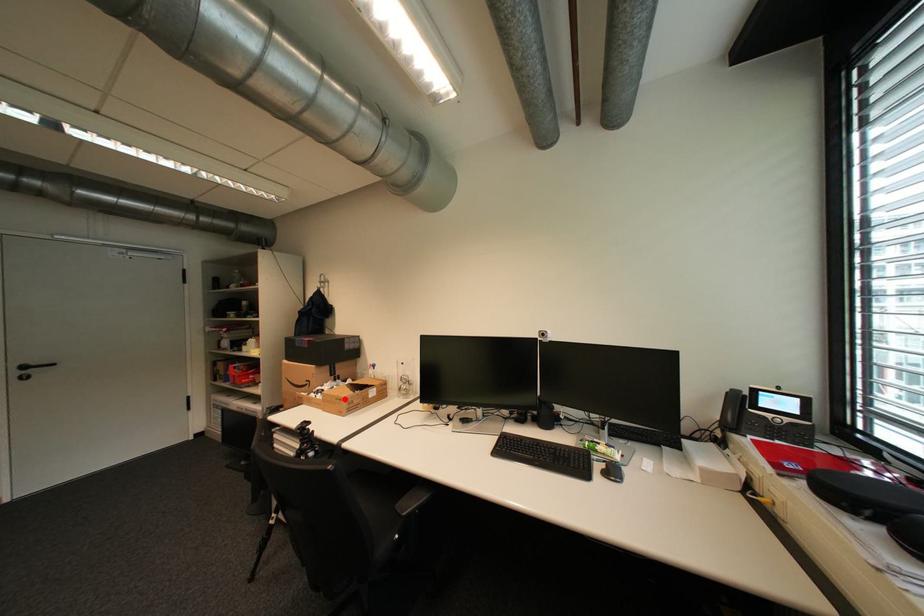
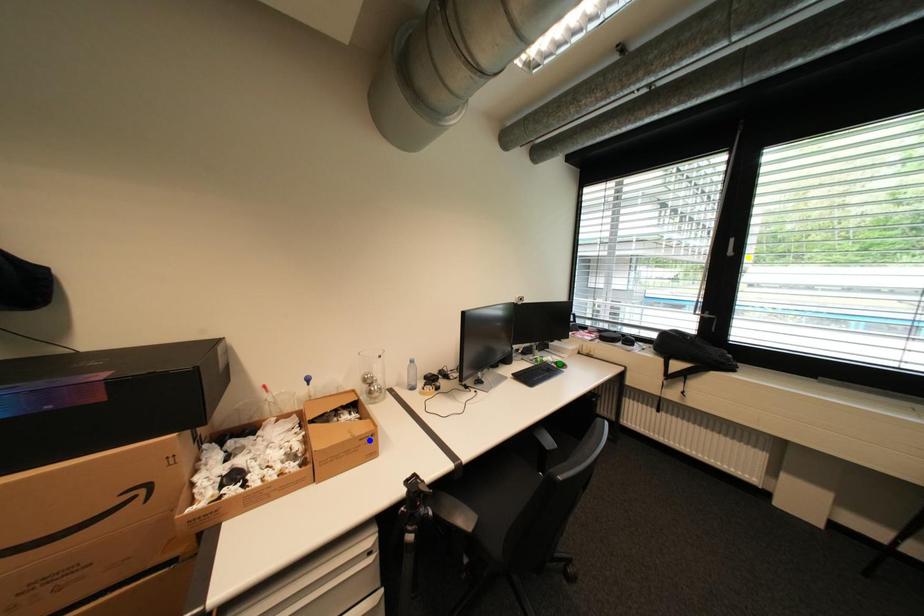
Question: I am providing you with two images of the same scene from different viewpoints. A red point is marked on the first image. You are given multiple points on the second image. Which point in image 2 is actually the same real-world point as the red point in image 1?

Choices:
 (A) green point
 (B) yellow point
 (C) blue point

Answer: (C)